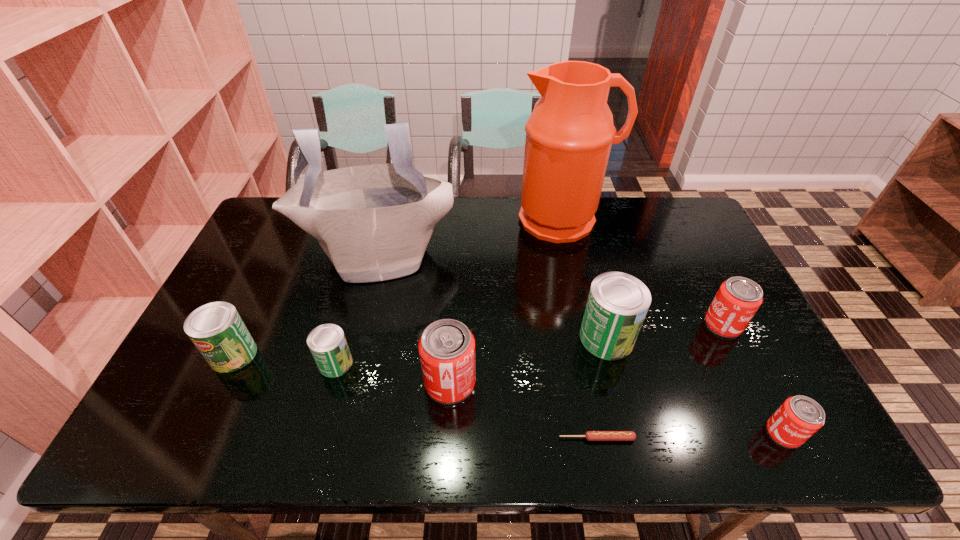
Find the location of a particular element. The height and width of the screenshot is (540, 960). water jug is located at coordinates (569, 134).

Where is `the eighth shortest object`? Image resolution: width=960 pixels, height=540 pixels. the eighth shortest object is located at coordinates (374, 222).

I want to click on the biggest red can, so click(x=446, y=348).

Image resolution: width=960 pixels, height=540 pixels. I want to click on the second farthest red can, so click(446, 348).

Locate an element on the screen. The height and width of the screenshot is (540, 960). the rightmost green can is located at coordinates (617, 304).

This screenshot has width=960, height=540. In order to click on the biggest green can in this screenshot , I will do `click(617, 304)`.

Image resolution: width=960 pixels, height=540 pixels. I want to click on the farthest red can, so click(x=738, y=299).

This screenshot has height=540, width=960. In order to click on the leftmost can in this screenshot , I will do `click(216, 329)`.

Find the location of a particular element. The image size is (960, 540). the leftmost object is located at coordinates (216, 329).

This screenshot has height=540, width=960. I want to click on the fifth can from right to left, so click(327, 343).